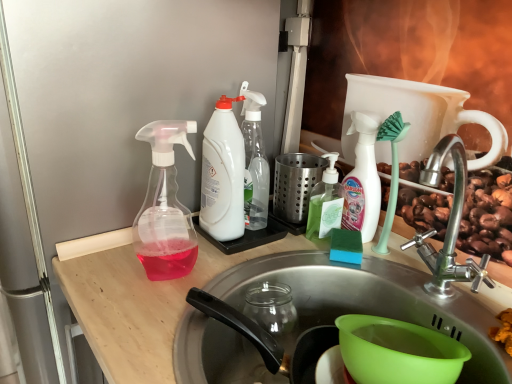
Question: Is green translucent soap dispenser at center, which is the 2th bottle in right-to-left order, to the left or to the right of white plastic spray bottle at center, which is counted as the 3th bottle, starting from the right, in the image?

Choices:
 (A) left
 (B) right

Answer: (B)

Question: Is green translucent soap dispenser at center, which is the fourth bottle in left-to-right order, inside or outside of white plastic spray bottle at center, which is counted as the 3th bottle, starting from the right?

Choices:
 (A) outside
 (B) inside

Answer: (A)

Question: Which is nearer to the white matte bottle at center, positioned as the fifth bottle in left-to-right order?

Choices:
 (A) transparent plastic spray bottle at left, the first bottle when ordered from left to right
 (B) stainless steel sink at center
 (C) green translucent soap dispenser at center, which is the fourth bottle in left-to-right order
 (D) white plastic bottle at center, arranged as the 2th bottle when viewed from the left
 (E) white plastic spray bottle at center, which is counted as the 3th bottle, starting from the right

Answer: (C)

Question: Based on their relative distances, which object is farther from the green translucent soap dispenser at center, which is the fourth bottle in left-to-right order?

Choices:
 (A) transparent plastic spray bottle at left, acting as the 5th bottle starting from the right
 (B) white plastic bottle at center, arranged as the 2th bottle when viewed from the left
 (C) white matte bottle at center, positioned as the fifth bottle in left-to-right order
 (D) white plastic spray bottle at center, which is counted as the 3th bottle, starting from the right
 (E) stainless steel sink at center

Answer: (A)